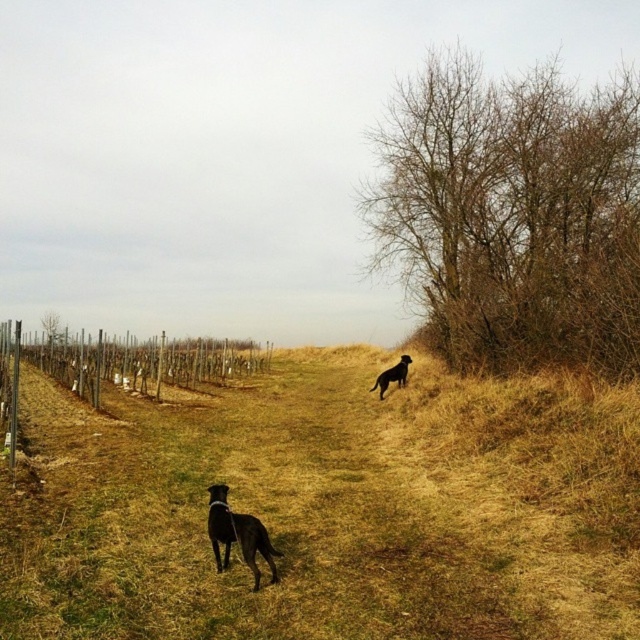
You are standing at the point marked by the coordinates point (x=128, y=364), which is at the left side of the image. You want to walk towards the second dog on the right side of the image. Will you first encounter the wooden posts at left or the second dog on the right side?

The point (x=128, y=364) marks wooden posts at left, so you are already at the wooden posts at left. Therefore, you cannot encounter them again while moving towards the second dog on the right side.

In the scene shown: You are a photographer trying to capture a shot of the black matte dog at center and the wooden posts at left. From your current position, which object is higher in the frame?

The wooden posts at left are higher in the frame than the black matte dog at center because the wooden posts at left is located above black matte dog at center.

You are a photographer trying to capture both the wooden posts at left and the black matte dog at center in the same frame. Based on their positions, which object is closer to the left edge of the photo?

The wooden posts at left are positioned on the left side of the black matte dog at center, so they are closer to the left edge of the photo.